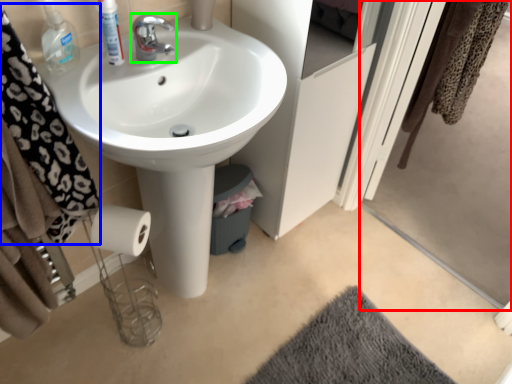
Question: Based on their relative distances, which object is nearer to screen door (highlighted by a red box)? Choose from bath towel (highlighted by a blue box) and tap (highlighted by a green box).

Choices:
 (A) bath towel
 (B) tap

Answer: (B)